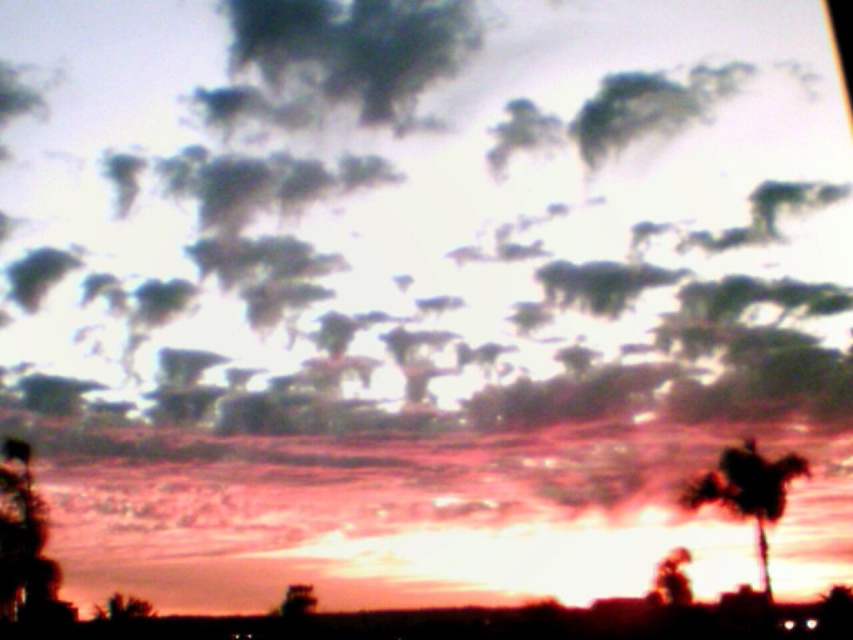
Question: Does white fluffy cloud at upper center have a smaller size compared to silhouette leafy palm at right?

Choices:
 (A) yes
 (B) no

Answer: (B)

Question: Does white fluffy cloud at upper center appear on the right side of silhouette leafy palm at right?

Choices:
 (A) yes
 (B) no

Answer: (B)

Question: Considering the relative positions of white fluffy cloud at upper center and silhouette leafy palm at right in the image provided, where is white fluffy cloud at upper center located with respect to silhouette leafy palm at right?

Choices:
 (A) left
 (B) right

Answer: (A)